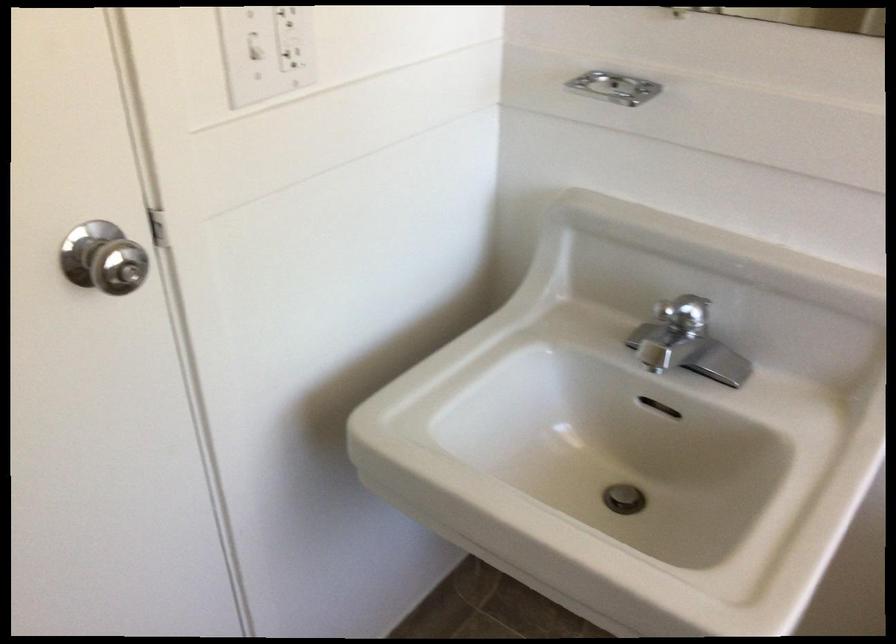
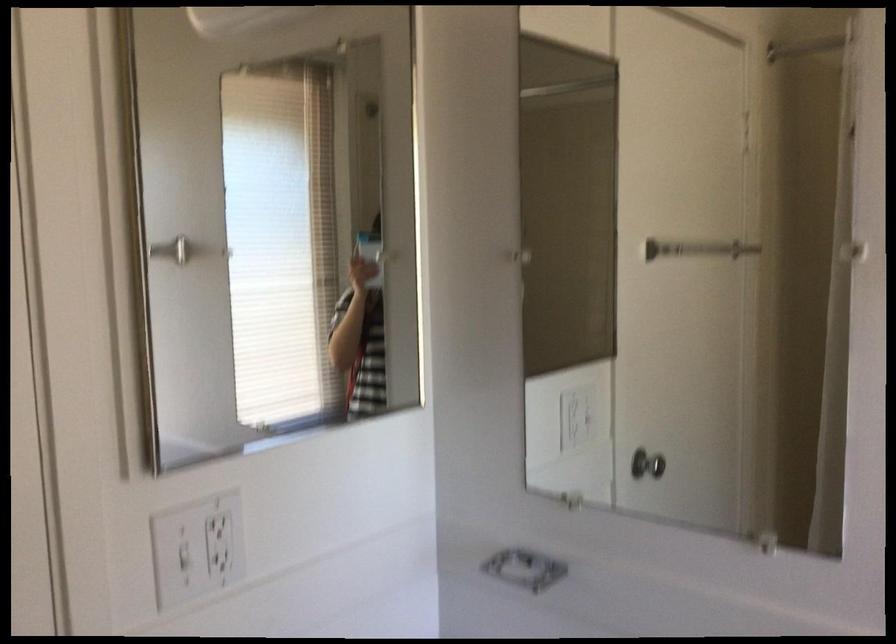
In a continuous first-person perspective shot, in which direction is the camera moving?

The cameraman moved toward right, backward.